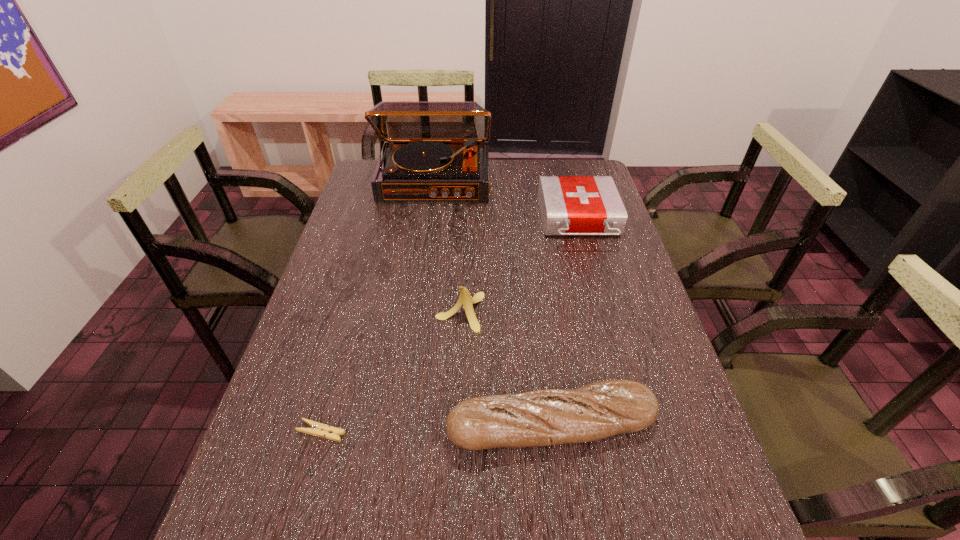
The width and height of the screenshot is (960, 540). Find the location of `the tallest object`. the tallest object is located at coordinates (434, 150).

You are a GUI agent. You are given a task and a screenshot of the screen. Output one action in this format:
    pyautogui.click(x=<x>, y=<y>)
    Task: Click on the banana
    
    Given the screenshot: What is the action you would take?
    pyautogui.click(x=465, y=299)

Locate an element on the screen. Image resolution: width=960 pixels, height=540 pixels. the second tallest object is located at coordinates (465, 299).

At what (x,y) coordinates should I click in order to perform the action: click on baguet. Please return your answer as a coordinate pair (x, y). Looking at the image, I should click on (598, 410).

In order to click on the first-aid kit in this screenshot , I will do `click(570, 205)`.

The image size is (960, 540). I want to click on the shortest object, so click(318, 429).

Locate an element on the screen. vacant space positioned 0.220m on the front-facing side of the record player is located at coordinates (426, 246).

The width and height of the screenshot is (960, 540). What are the coordinates of `vacant point located 0.110m on the back of the banana` in the screenshot? It's located at (462, 266).

Locate an element on the screen. blank space located on the front of the baguet is located at coordinates (564, 514).

This screenshot has width=960, height=540. I want to click on free point located 0.320m on the front side of the first-aid kit, so click(x=609, y=329).